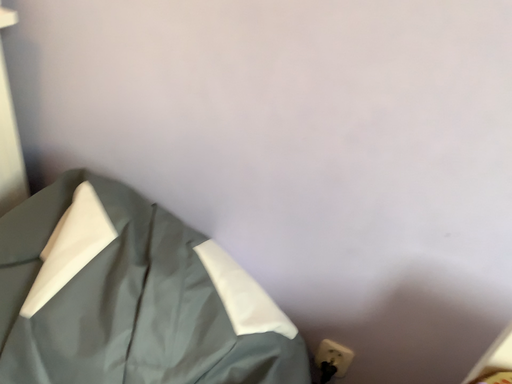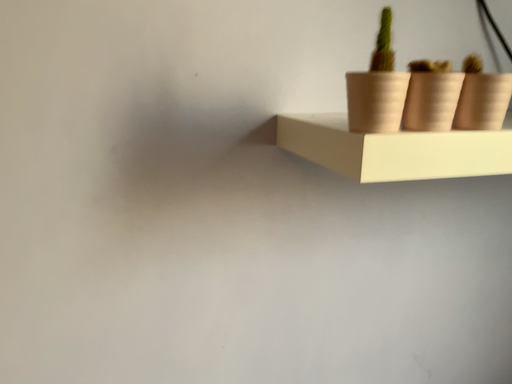
Question: Which way did the camera rotate in the video?

Choices:
 (A) rotated upward
 (B) rotated downward

Answer: (A)